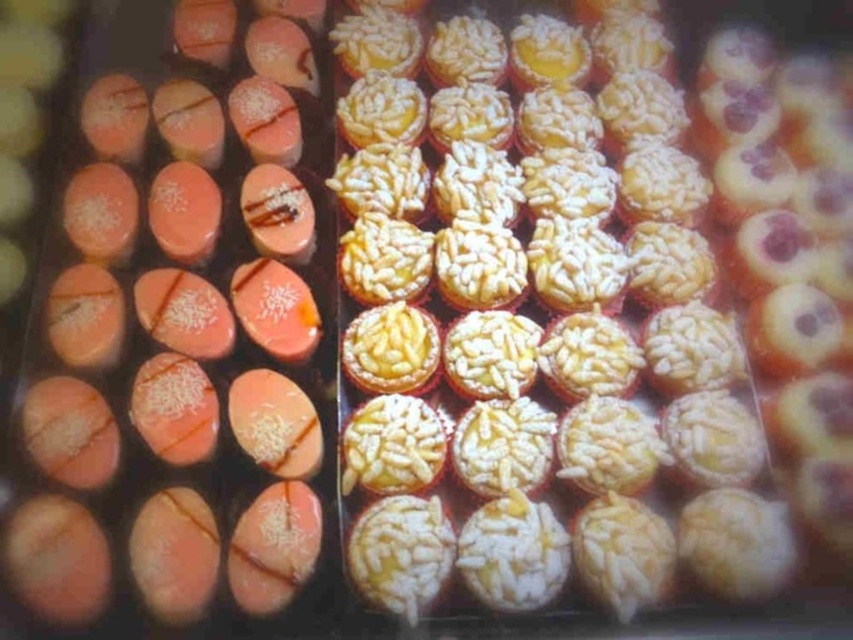
You are a baker who needs to place both the white sugary cupcake at center and the matte pink chocolate at center into a display case that can only accommodate items up to the width of the wider object. Which pastry should determine the maximum width allowed for the display case?

The white sugary cupcake at center should determine the maximum width allowed for the display case because its width surpasses that of the matte pink chocolate at center.

You are a customer at the bakery and want to take a photo of both the white sugary cupcake at center and the matte pink chocolate at center. However, the cupcake is blocking your view of the chocolate. How can you adjust your position to see both items clearly?

The matte pink chocolate at center is behind the white sugary cupcake at center. To see both items clearly, you should move to a position where you can look around or behind the white sugary cupcake at center to capture the matte pink chocolate at center in your view.

You are a customer at the bakery and want to buy the white sugary cupcake at center. The cupcakes are arranged in a grid pattern. If the cupcake you want is located at point coordinates (535,324), which is the center position, how would you describe its location to the baker?

The white sugary cupcake at center is located at the coordinates point (535,324), which is the center position of the grid.